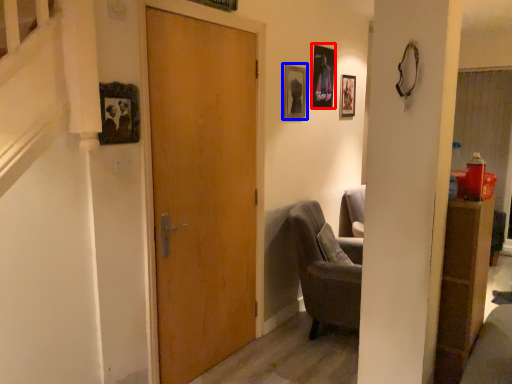
Question: Among these objects, which one is nearest to the camera, picture frame (highlighted by a red box) or picture frame (highlighted by a blue box)?

Choices:
 (A) picture frame
 (B) picture frame

Answer: (B)